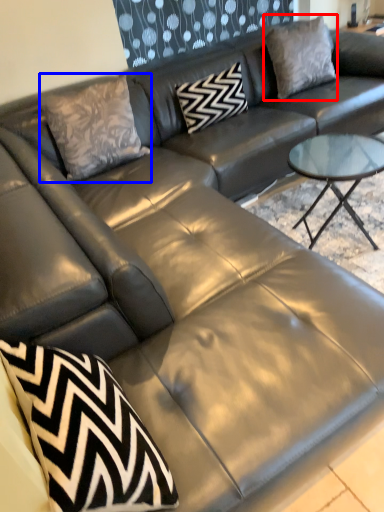
Question: Which object is closer to the camera taking this photo, pillow (highlighted by a red box) or throw pillow (highlighted by a blue box)?

Choices:
 (A) pillow
 (B) throw pillow

Answer: (B)